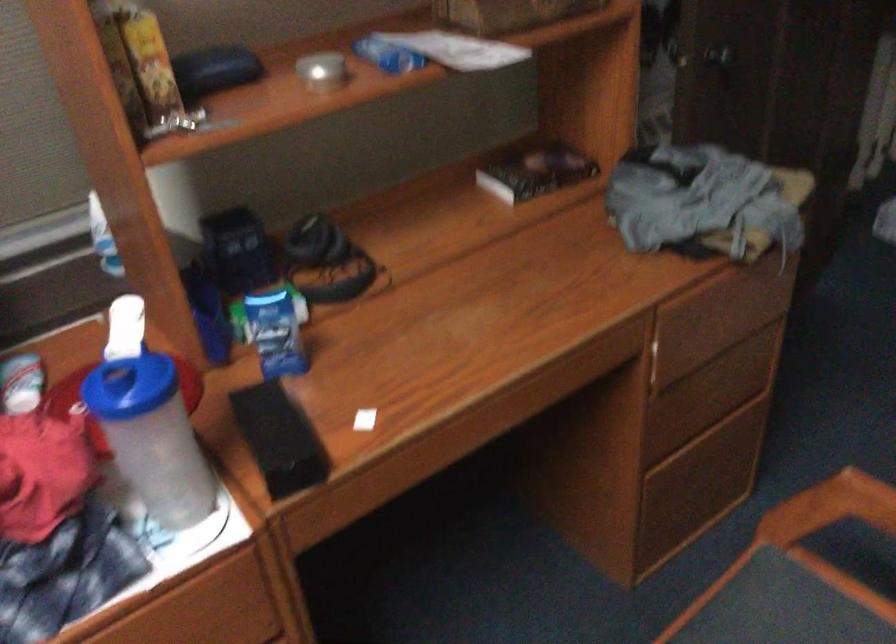
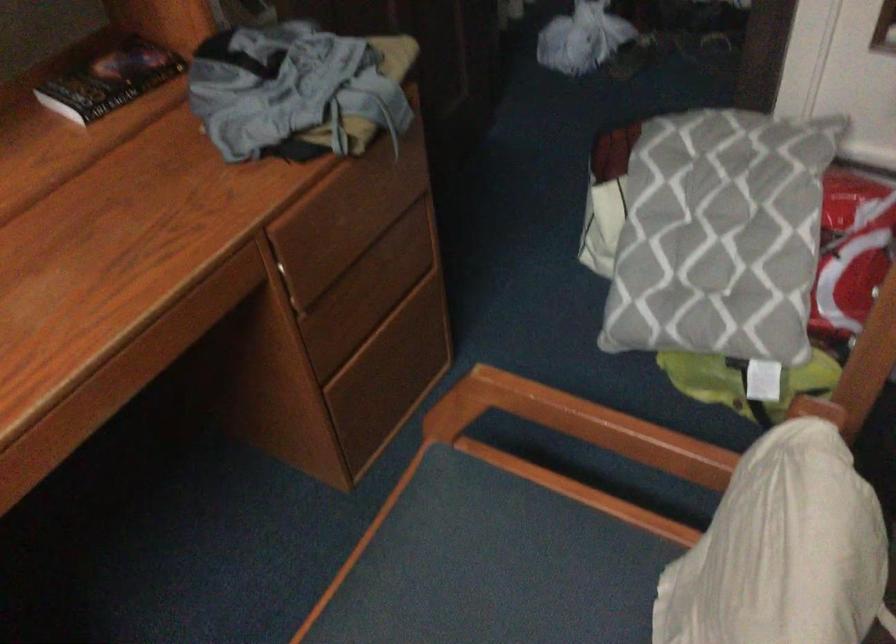
Locate, in the second image, the point that corresponds to the point at 665,357 in the first image.

(299, 276)